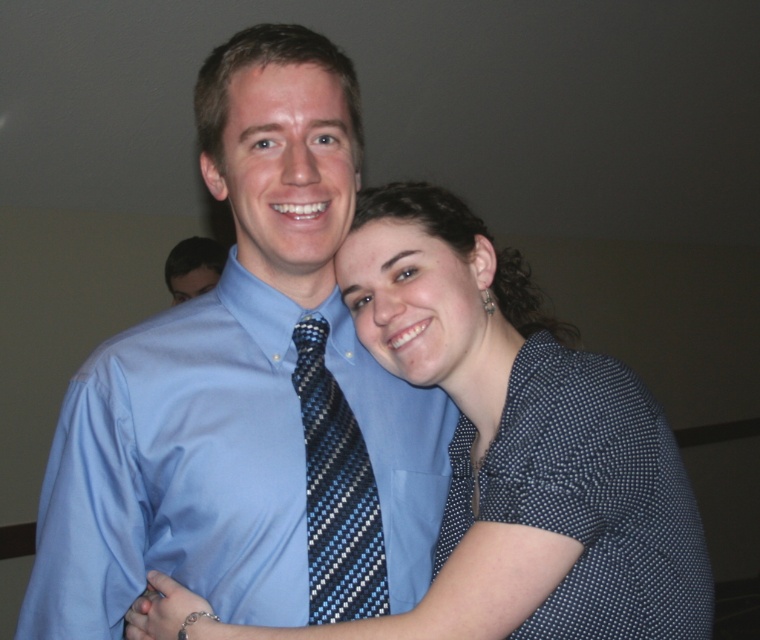
Between point (198, 406) and point (173, 244), which one is positioned in front?

Point (198, 406) is more forward.

I want to click on light blue satin shirt at center, so click(x=219, y=465).

Is point (171, 362) behind point (173, 276)?

No, it is not.

Find the location of a particular element. The width and height of the screenshot is (760, 640). light blue satin shirt at center is located at coordinates [x=219, y=465].

Which is behind, point (309, 465) or point (209, 284)?

The point (209, 284) is behind.

Is blue striped tie at center above blue silk shirt at center?

Incorrect, blue striped tie at center is not positioned above blue silk shirt at center.

Image resolution: width=760 pixels, height=640 pixels. Describe the element at coordinates (336, 492) in the screenshot. I see `blue striped tie at center` at that location.

Identify the location of blue striped tie at center. The height and width of the screenshot is (640, 760). (336, 492).

Can you confirm if light blue satin shirt at center is taller than blue striped tie at center?

Correct, light blue satin shirt at center is much taller as blue striped tie at center.

Between point (426, 394) and point (337, 552), which one is positioned behind?

Point (426, 394)

What are the coordinates of `light blue satin shirt at center` in the screenshot? It's located at (219, 465).